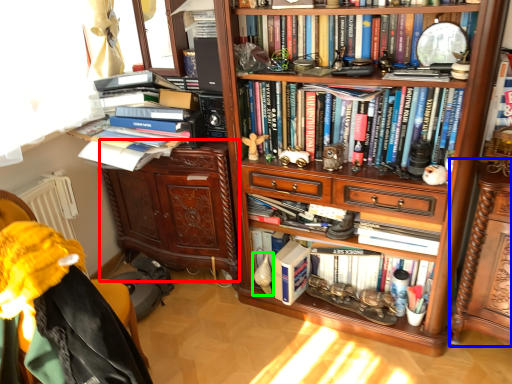
Question: Which object is positioned farthest from cabinetry (highlighted by a red box)? Select from shelf (highlighted by a blue box) and toy (highlighted by a green box).

Choices:
 (A) shelf
 (B) toy

Answer: (A)